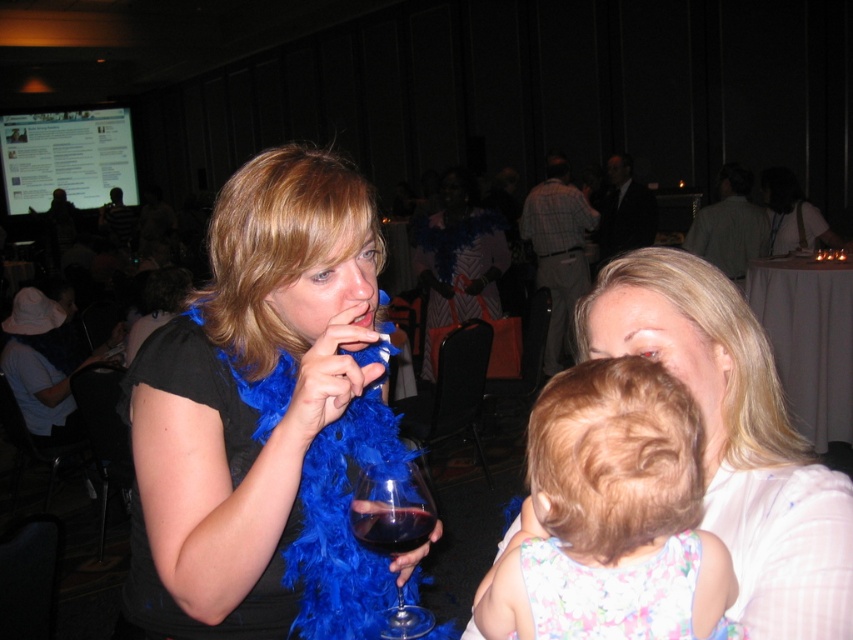
Consider the image. Is blue feather boa at center to the left of dark glass beverage at center from the viewer's perspective?

Indeed, blue feather boa at center is positioned on the left side of dark glass beverage at center.

Is blue feather boa at center above dark glass beverage at center?

Yes, blue feather boa at center is above dark glass beverage at center.

Identify the location of blue feather boa at center. (263, 417).

This screenshot has width=853, height=640. What are the coordinates of `blue feather boa at center` in the screenshot? It's located at (263, 417).

Is smooth white blouse at center above transparent glass wine glass at center?

Correct, smooth white blouse at center is located above transparent glass wine glass at center.

This screenshot has height=640, width=853. What do you see at coordinates (735, 436) in the screenshot?
I see `smooth white blouse at center` at bounding box center [735, 436].

Is point (759, 412) positioned after point (380, 484)?

That is True.

Identify the location of smooth white blouse at center. The width and height of the screenshot is (853, 640). (735, 436).

Consider the image. Does blue feather boa at center have a smaller size compared to smooth white blouse at center?

Actually, blue feather boa at center might be larger than smooth white blouse at center.

Between blue feather boa at center and smooth white blouse at center, which one is positioned higher?

Positioned higher is blue feather boa at center.

Between point (322, 576) and point (502, 545), which one is positioned behind?

The point (322, 576) is more distant.

Identify the location of blue feather boa at center. [x=263, y=417].